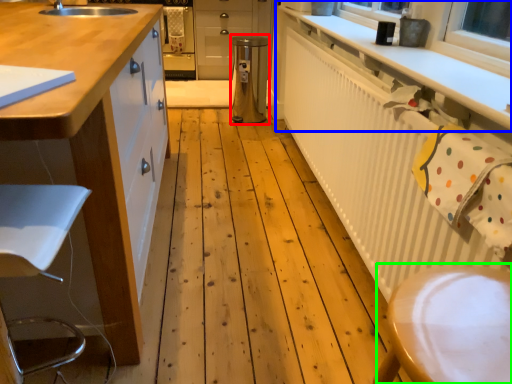
Question: Based on their relative distances, which object is nearer to appliance (highlighted by a red box)? Choose from countertop (highlighted by a blue box) and step stool (highlighted by a green box).

Choices:
 (A) countertop
 (B) step stool

Answer: (A)